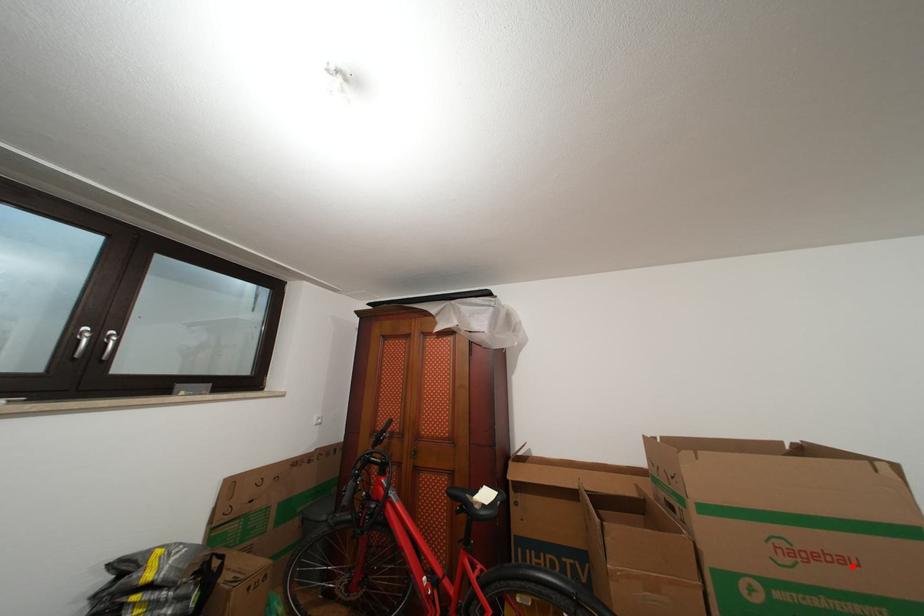
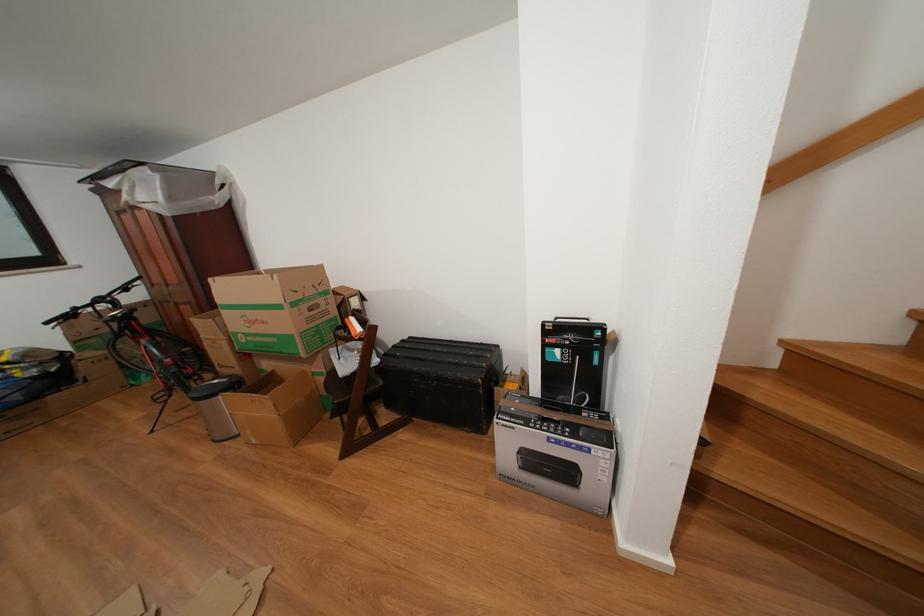
Locate, in the second image, the point that corresponds to the highlighted location in the first image.

(272, 328)